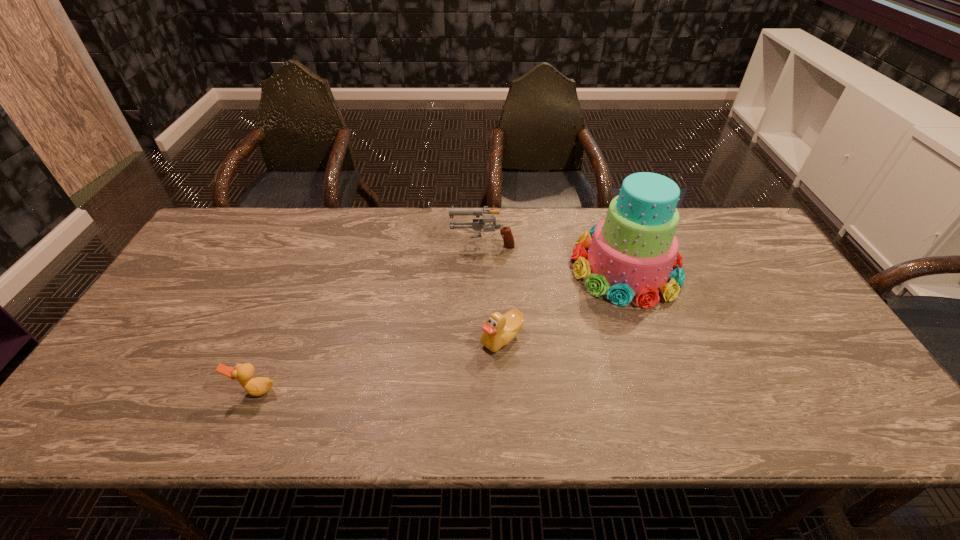
Where is `cake`? The width and height of the screenshot is (960, 540). cake is located at coordinates (633, 250).

Find the location of a particular element. This screenshot has width=960, height=540. the tallest object is located at coordinates (633, 250).

Find the location of a particular element. Image resolution: width=960 pixels, height=540 pixels. the second tallest object is located at coordinates (478, 224).

At what (x,y) coordinates should I click in order to perform the action: click on the third farthest object. Please return your answer as a coordinate pair (x, y). Looking at the image, I should click on (499, 330).

Identify the location of the farther duck. (499, 330).

This screenshot has height=540, width=960. In order to click on the left duck in this screenshot , I will do `click(258, 386)`.

I want to click on the leftmost object, so click(x=258, y=386).

This screenshot has height=540, width=960. I want to click on free space located 0.200m on the right of the rightmost object, so click(746, 267).

At what (x,y) coordinates should I click in order to perform the action: click on vacant space located 0.390m at the barrel end of the third shortest object. Please return your answer as a coordinate pair (x, y). Looking at the image, I should click on (328, 243).

Find the location of a particular element. vacant area situated at the barrel end of the third shortest object is located at coordinates (429, 243).